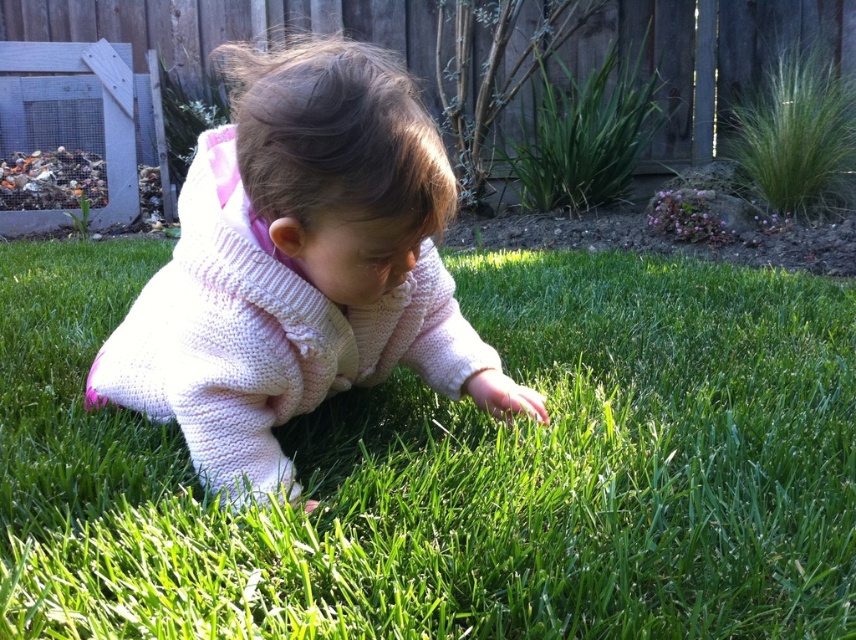
You are a parent watching your child play in the backyard. You notice a point marked at coordinates (455,468) in the image. Based on the scene description, what is located at that point?

The point at coordinates (455,468) indicates green grass at center.

The child is wearing a knitted pink sweater at center and crawling on the green grass at center. Which item is taller?

The knitted pink sweater at center is taller than the green grass at center.

The child is crawling on the green grass at center and wearing a knitted pink sweater at center. Which object is positioned to the right of the other?

The green grass at center is to the right of the knitted pink sweater at center.